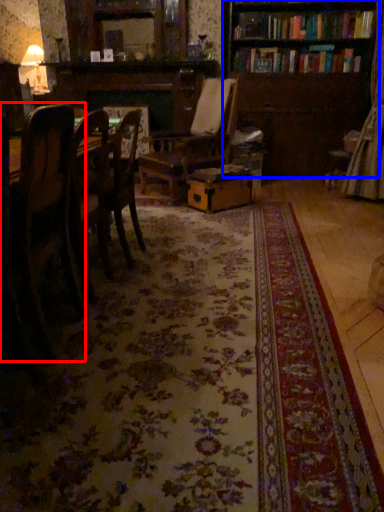
Question: Which object appears closest to the camera in this image, chair (highlighted by a red box) or bookcase (highlighted by a blue box)?

Choices:
 (A) chair
 (B) bookcase

Answer: (A)